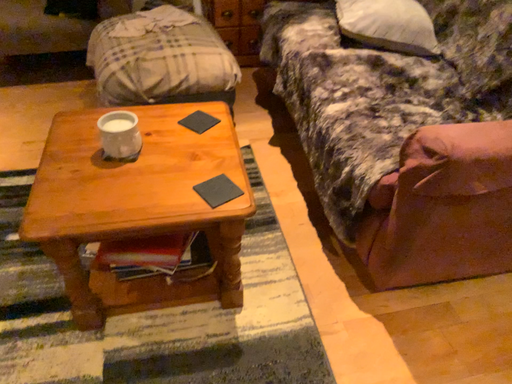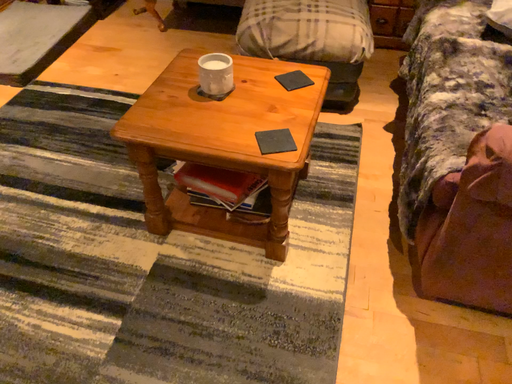
Question: How did the camera likely rotate when shooting the video?

Choices:
 (A) rotated right
 (B) rotated left

Answer: (B)